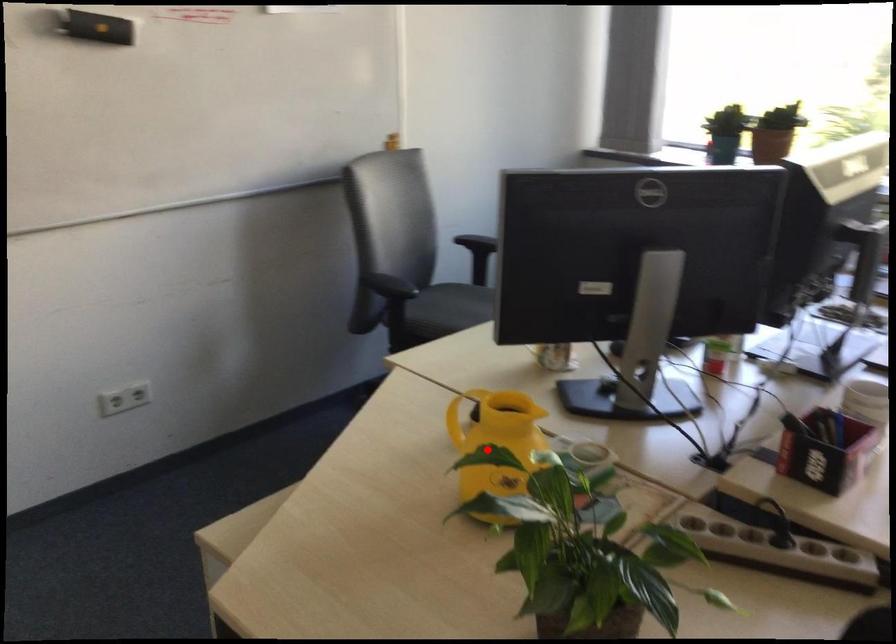
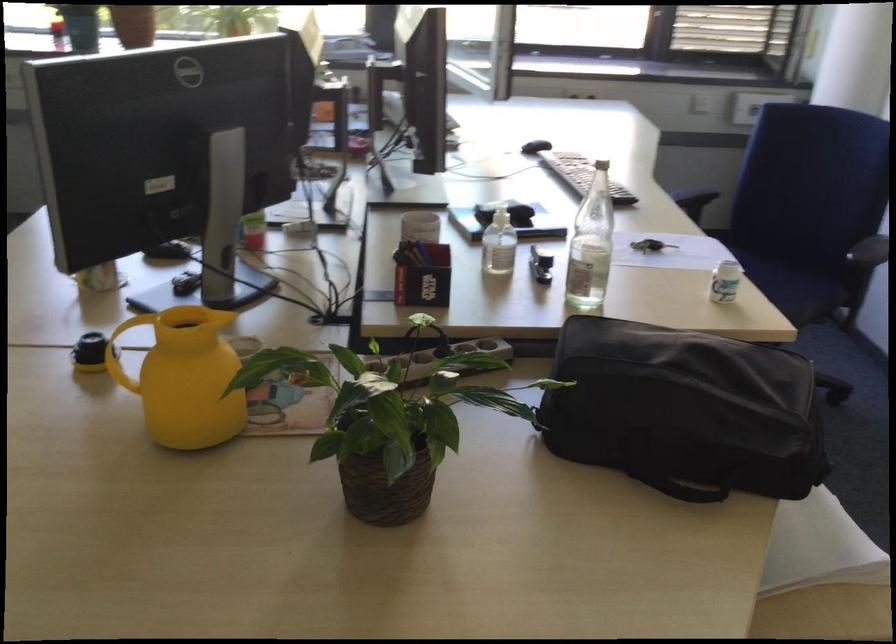
Question: I am providing you with two images of the same scene from different viewpoints. A red point is marked on the first image. Can you still see the location of the red point in image 2?

Choices:
 (A) Yes
 (B) No

Answer: (A)